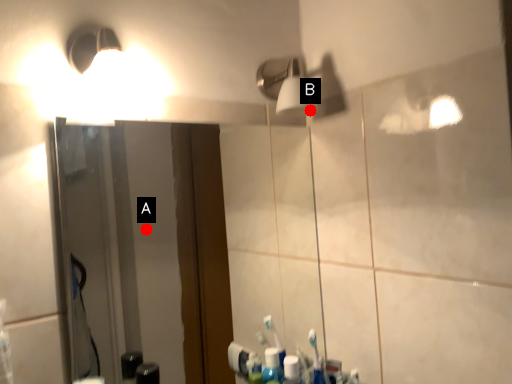
Question: Two points are circled on the image, labeled by A and B beside each circle. Which point is farther to the camera?

Choices:
 (A) A is further
 (B) B is further

Answer: (A)